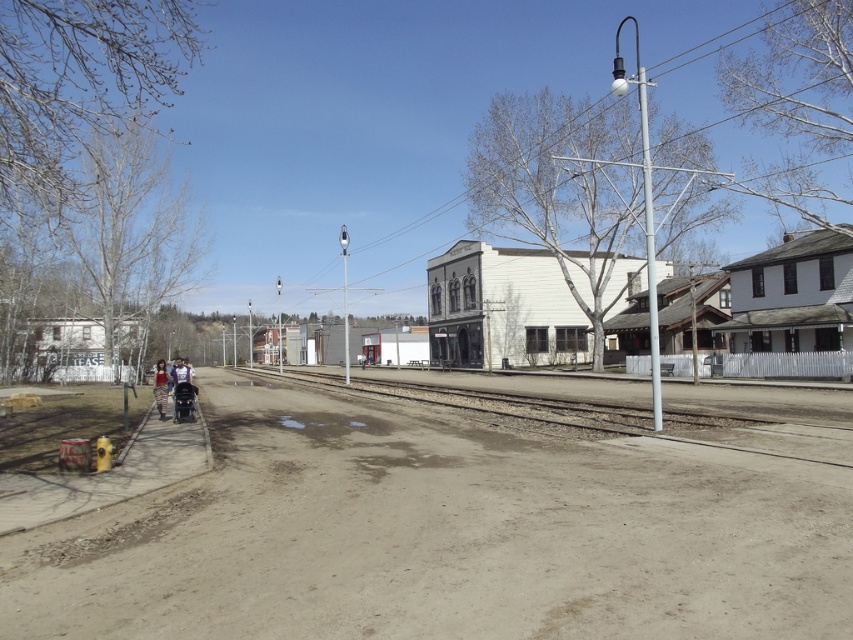
You are standing at the point marked by the coordinates point (450, 531). What is the terrain like under your feet?

The terrain under your feet at point (450, 531) is brown sandy dirt track at lower center.

You are standing at the dirt path in the rural scene and want to reach a specific point. Which of the two points, point (850,556) or point (521,381), is closer to you?

Point (850,556) is closer to the viewer than point (521,381).